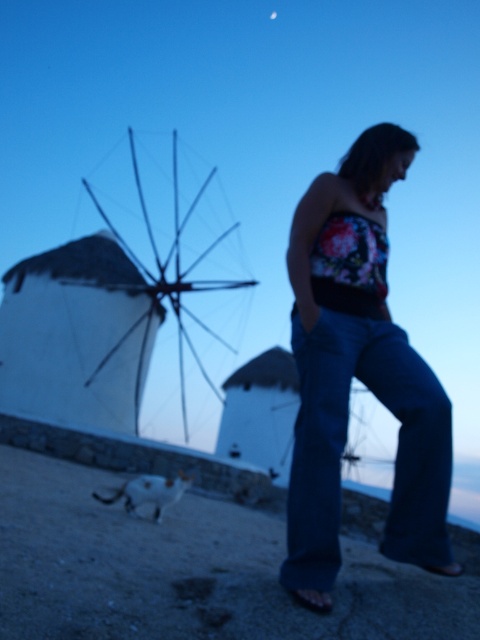
You are a photographer trying to capture a photo of the dark blue denim jeans at center and the white matte windmill at left. Based on their positions, which object should you focus on first if you want to include both in your frame without moving the camera?

You should focus on the white matte windmill at left first because the dark blue denim jeans at center is to the right of it, so positioning the camera to include both would require framing from the left side where the windmill is located.

You are an artist trying to sketch this scene. You want to ensure the proportions are accurate. Which object, the dark blue denim jeans at center or the white matte windmill at left, should you draw first to establish the scale of the scene?

The white matte windmill at left should be drawn first because it has a greater width than the dark blue denim jeans at center, making it a better reference point for establishing scale.